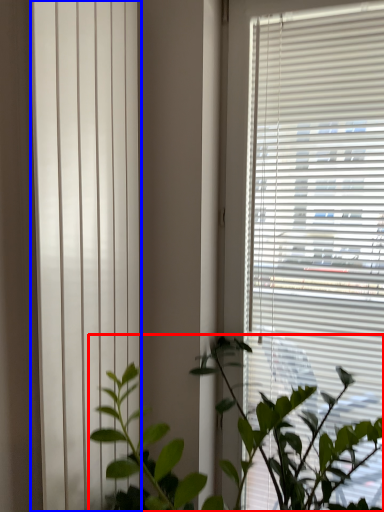
Question: Which of the following is the farthest to the observer, houseplant (highlighted by a red box) or shutter (highlighted by a blue box)?

Choices:
 (A) houseplant
 (B) shutter

Answer: (B)